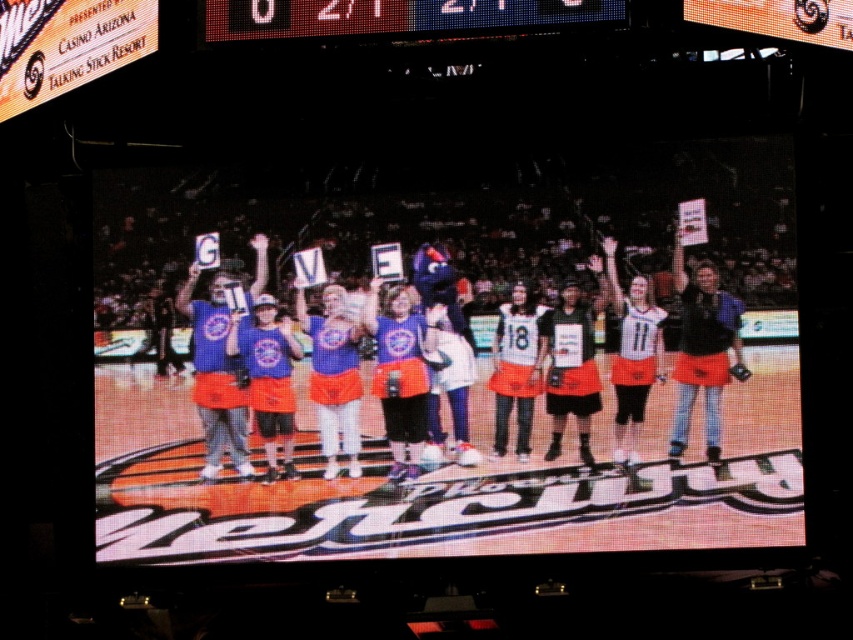
This screenshot has height=640, width=853. In order to click on blue jersey at center in this screenshot , I will do `click(339, 362)`.

Consider the image. Between blue jersey at center and led digital display at upper center, which one is positioned lower?

blue jersey at center is below.

What do you see at coordinates (339, 362) in the screenshot?
I see `blue jersey at center` at bounding box center [339, 362].

Image resolution: width=853 pixels, height=640 pixels. I want to click on blue jersey at center, so click(x=339, y=362).